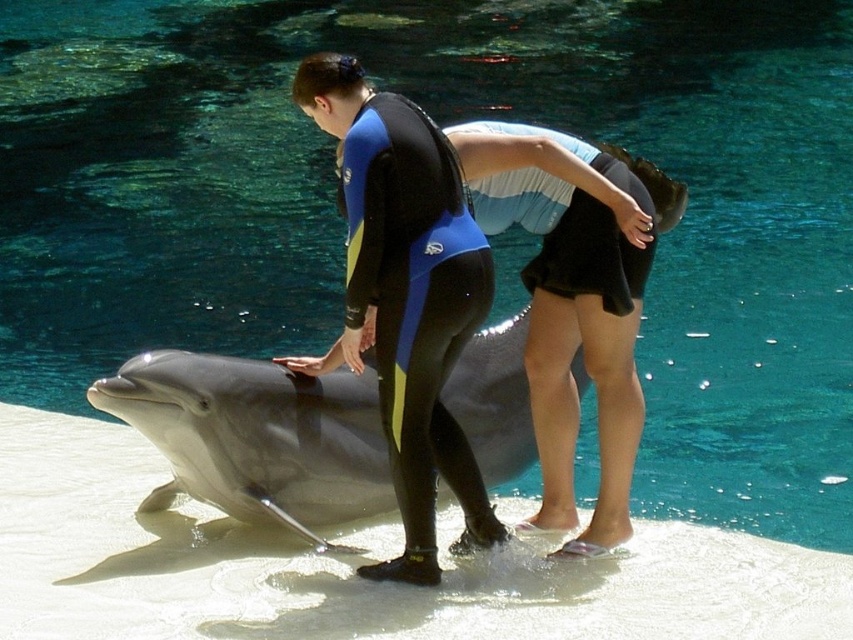
You are a marine biologist observing the scene. You need to determine the relative positions of the smooth gray dolphin at center and the black neoprene wetsuit at center. Which object is positioned to the left?

The smooth gray dolphin at center is to the left of the black neoprene wetsuit at center.

You are a marine biologist observing the scene. You need to locate the smooth gray dolphin at center for a study. What are its coordinates in the image?

The smooth gray dolphin at center is located at coordinates 0.683 and 0.301.

You are a marine biologist observing the scene. You need to determine which object is wider between the smooth gray dolphin at center and the black neoprene wetsuit at center. Based on the scene, which one is wider?

The smooth gray dolphin at center is wider than the black neoprene wetsuit at center.